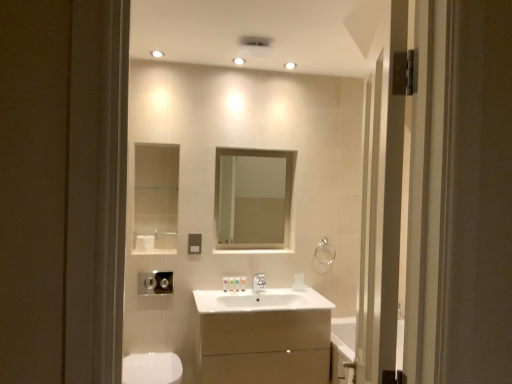
Question: Is silver metallic faucet at center oriented towards white glossy light fixture at upper center?

Choices:
 (A) no
 (B) yes

Answer: (A)

Question: From a real-world perspective, does silver metallic faucet at center sit lower than white glossy light fixture at upper center?

Choices:
 (A) yes
 (B) no

Answer: (A)

Question: Does silver metallic faucet at center lie in front of white glossy light fixture at upper center?

Choices:
 (A) no
 (B) yes

Answer: (B)

Question: Does silver metallic faucet at center have a lesser height compared to white glossy light fixture at upper center?

Choices:
 (A) no
 (B) yes

Answer: (A)

Question: Is silver metallic faucet at center taller than white glossy light fixture at upper center?

Choices:
 (A) no
 (B) yes

Answer: (B)

Question: Is white glossy toilet bowl at lower left wider or thinner than white glossy light fixture at upper center?

Choices:
 (A) thin
 (B) wide

Answer: (B)

Question: In the image, is white glossy toilet bowl at lower left on the left side or the right side of white glossy light fixture at upper center?

Choices:
 (A) left
 (B) right

Answer: (A)

Question: Is point (134, 377) positioned closer to the camera than point (286, 64)?

Choices:
 (A) farther
 (B) closer

Answer: (B)

Question: Based on their sizes in the image, would you say white glossy toilet bowl at lower left is bigger or smaller than white glossy light fixture at upper center?

Choices:
 (A) big
 (B) small

Answer: (A)

Question: Looking at the image, does silver metallic faucet at center seem bigger or smaller compared to white matte toilet paper at upper left?

Choices:
 (A) small
 (B) big

Answer: (B)

Question: From the image's perspective, is silver metallic faucet at center located above or below white matte toilet paper at upper left?

Choices:
 (A) below
 (B) above

Answer: (A)

Question: Considering their positions, is silver metallic faucet at center located in front of or behind white matte toilet paper at upper left?

Choices:
 (A) behind
 (B) front

Answer: (B)

Question: In terms of height, does silver metallic faucet at center look taller or shorter compared to white matte toilet paper at upper left?

Choices:
 (A) tall
 (B) short

Answer: (A)

Question: From a real-world perspective, is clear glass mirror at center positioned above or below translucent plastic soap at center, arranged as the 1th toiletry when viewed from the left?

Choices:
 (A) below
 (B) above

Answer: (B)

Question: Considering their positions, is clear glass mirror at center located in front of or behind translucent plastic soap at center, the second toiletry in the right-to-left sequence?

Choices:
 (A) behind
 (B) front

Answer: (A)